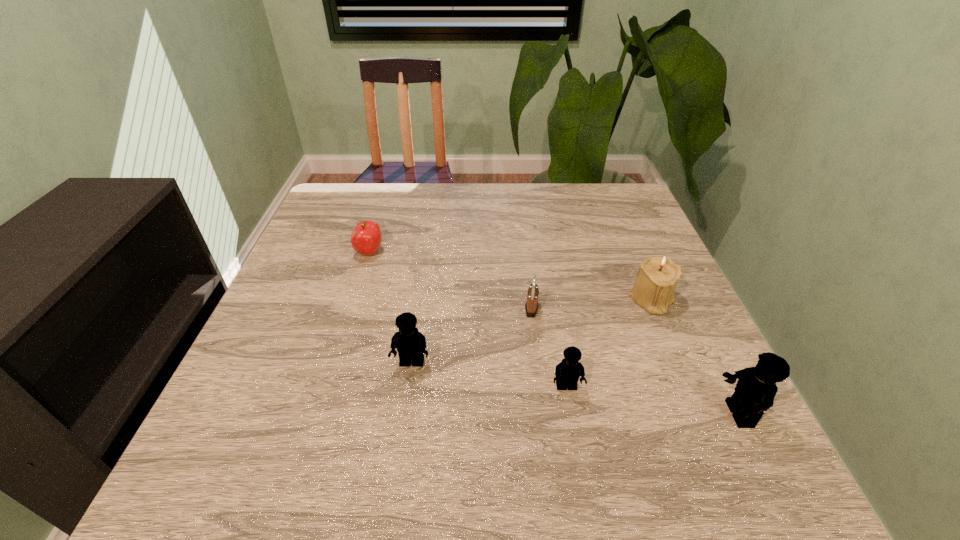
Locate an element on the screen. The width and height of the screenshot is (960, 540). free space located on the front-facing side of the third object from right to left is located at coordinates [x=574, y=431].

Identify the location of vacant space located on the front-facing side of the tallest object. [x=636, y=414].

Find the location of `vacant point located 0.200m on the front-facing side of the tallest object`. vacant point located 0.200m on the front-facing side of the tallest object is located at coordinates (607, 414).

I want to click on free space located on the front-facing side of the tallest object, so click(x=539, y=414).

Locate an element on the screen. The width and height of the screenshot is (960, 540). vacant space situated on the right of the apple is located at coordinates (533, 252).

Identify the location of free space located 0.050m on the front of the candle_holder. Image resolution: width=960 pixels, height=540 pixels. (666, 333).

Locate an element on the screen. This screenshot has width=960, height=540. vacant space located on the front of the padlock is located at coordinates (540, 384).

The image size is (960, 540). What are the coordinates of `object situated at the left edge` in the screenshot? It's located at (366, 238).

I want to click on Lego located at the right edge, so click(755, 390).

Locate an element on the screen. The image size is (960, 540). candle_holder at the right edge is located at coordinates (657, 277).